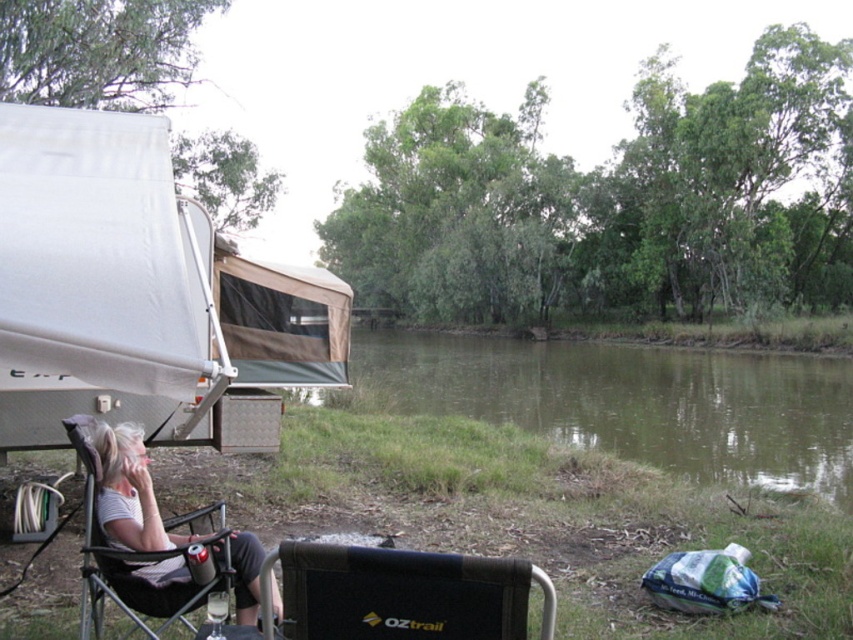
You are standing at the point labeled point (340, 573) and want to walk to the point labeled point (123, 436). Based on the scene description, will you be moving towards the caravan or away from it?

Since point (340, 573) is in front of point (123, 436), you are moving away from the caravan as you walk from the first point to the second point.

You are planning to set up a tent in the camping scene. The green grassy riverbank at center is the only suitable spot. Can you confirm its exact location coordinates?

The green grassy riverbank at center is located at point [628,401].